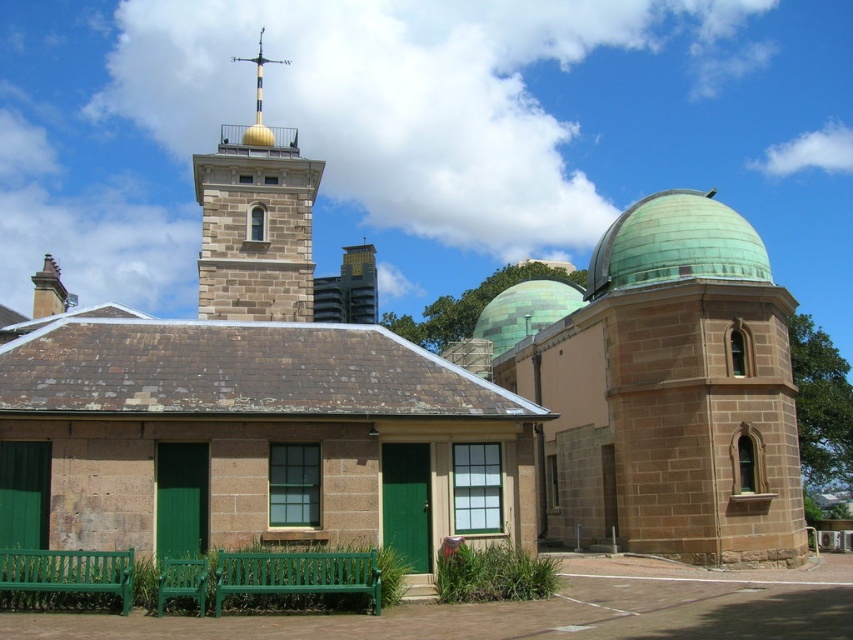
Who is taller, green wooden bench at lower center or green polished dome at center?

With more height is green polished dome at center.

Does green wooden bench at lower center have a greater height compared to green polished dome at center?

No, green wooden bench at lower center is not taller than green polished dome at center.

Does point (320, 576) lie behind point (500, 323)?

No.

The width and height of the screenshot is (853, 640). I want to click on green wooden bench at lower center, so click(297, 573).

Which is more to the right, green stone dome at upper right or green wooden bench at lower center?

From the viewer's perspective, green stone dome at upper right appears more on the right side.

Is point (759, 310) less distant than point (375, 605)?

No.

Locate an element on the screen. The height and width of the screenshot is (640, 853). green stone dome at upper right is located at coordinates (669, 394).

Which is below, green stone dome at upper right or gold polished metal spire at upper center?

green stone dome at upper right is below.

Between green stone dome at upper right and gold polished metal spire at upper center, which one appears on the left side from the viewer's perspective?

gold polished metal spire at upper center

Between point (660, 436) and point (262, 81), which one is positioned behind?

The point (262, 81) is behind.

Identify the location of green stone dome at upper right. (669, 394).